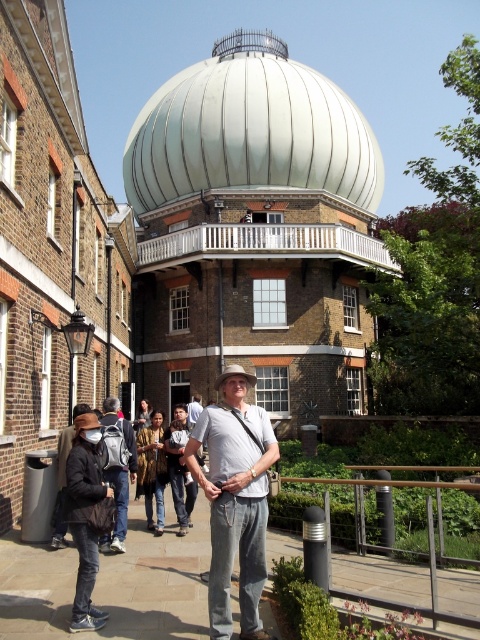
Question: Among these points, which one is farthest from the camera?

Choices:
 (A) (187, 465)
 (B) (348, 570)
 (C) (83, 476)
 (D) (147, 426)

Answer: (D)

Question: Does white metallic dome at center appear on the right side of dark brown leather jacket at lower left?

Choices:
 (A) yes
 (B) no

Answer: (A)

Question: Can you confirm if metallic dome at center is bigger than matte gray backpack at center-left?

Choices:
 (A) no
 (B) yes

Answer: (B)

Question: Does light gray cotton shirt at center have a smaller size compared to dark gray wool jacket at lower left?

Choices:
 (A) yes
 (B) no

Answer: (B)

Question: Which object is farther from the camera taking this photo?

Choices:
 (A) dark gray wool jacket at lower left
 (B) light gray cotton shirt at center

Answer: (A)

Question: Which object is farther from the camera taking this photo?

Choices:
 (A) patterned fabric jacket at center
 (B) dark gray wool jacket at lower left
 (C) white metallic dome at center

Answer: (C)